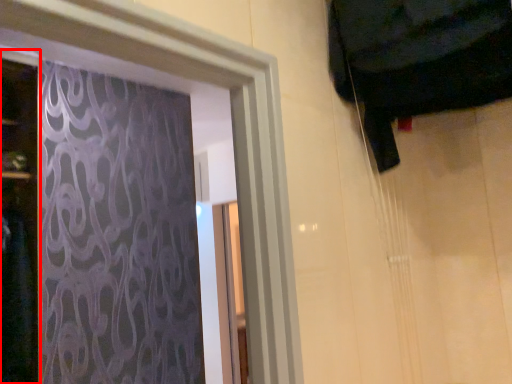
Question: From the image, what is the correct spatial relationship of door (annotated by the red box) in relation to curtain?

Choices:
 (A) right
 (B) left

Answer: (B)